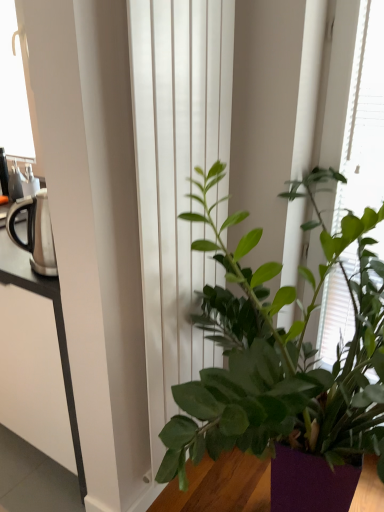
Question: From their relative heights in the image, would you say green leafy plant at center is taller or shorter than white smooth curtain at center?

Choices:
 (A) tall
 (B) short

Answer: (A)

Question: From the image's perspective, is green leafy plant at center above or below white smooth curtain at center?

Choices:
 (A) above
 (B) below

Answer: (A)

Question: Estimate the real-world distances between objects in this image. Which object is farther from the white smooth curtain at center?

Choices:
 (A) green leafy plant at center
 (B) silver metallic kettle at left
 (C) green matte plant at center

Answer: (A)

Question: Which is farther from the green leafy plant at center?

Choices:
 (A) white smooth curtain at center
 (B) green matte plant at center
 (C) silver metallic kettle at left

Answer: (C)